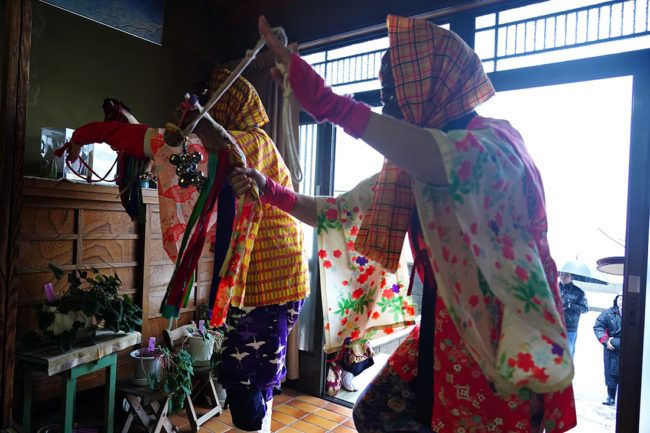
Locate an element on the screen. The height and width of the screenshot is (433, 650). shoe is located at coordinates (608, 400).